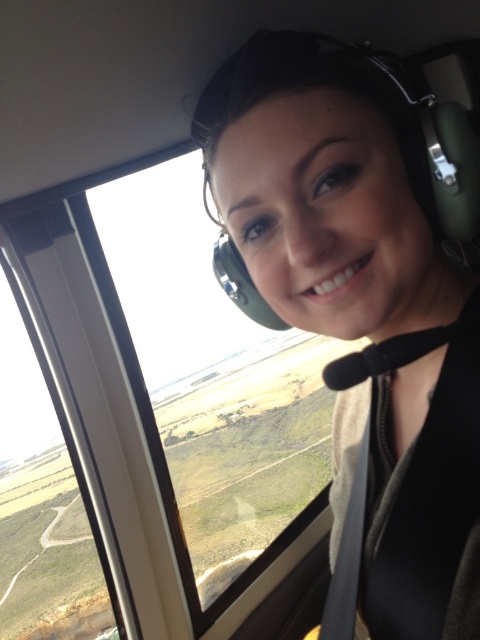
You are a passenger in the helicopter and want to see the view outside. Which object, the matte green headset at center or the transparent glass airplane window at center, is located to the right of the other?

The matte green headset at center is positioned on the right side of transparent glass airplane window at center.

Consider the image. You are a passenger in the helicopter and want to know which of the two points, point (324, 378) or point (321, 497), is closer to the helicopter window. Based on the coordinates provided, can you determine which point is closer?

Point (324, 378) is in front of point (321, 497), so it is closer to the helicopter window.

You are a passenger in the helicopter and want to see the view outside. Can you look through the transparent glass airplane window at center without removing the matte green headset at center?

The matte green headset at center has a lesser height compared to transparent glass airplane window at center, so yes, you can look through the transparent glass airplane window at center without removing the matte green headset at center since it is shorter and less likely to block your view.